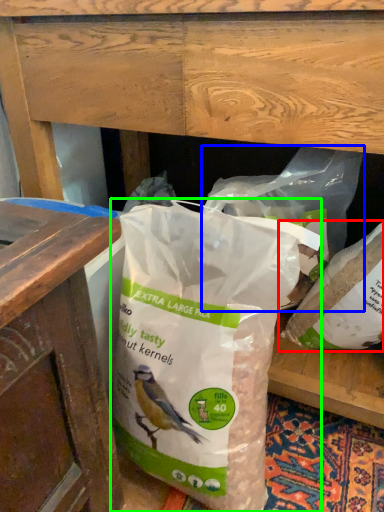
Question: Based on their relative distances, which object is farther from plastic bag (highlighted by a red box)? Choose from plastic bag (highlighted by a blue box) and plastic bag (highlighted by a green box).

Choices:
 (A) plastic bag
 (B) plastic bag

Answer: (B)